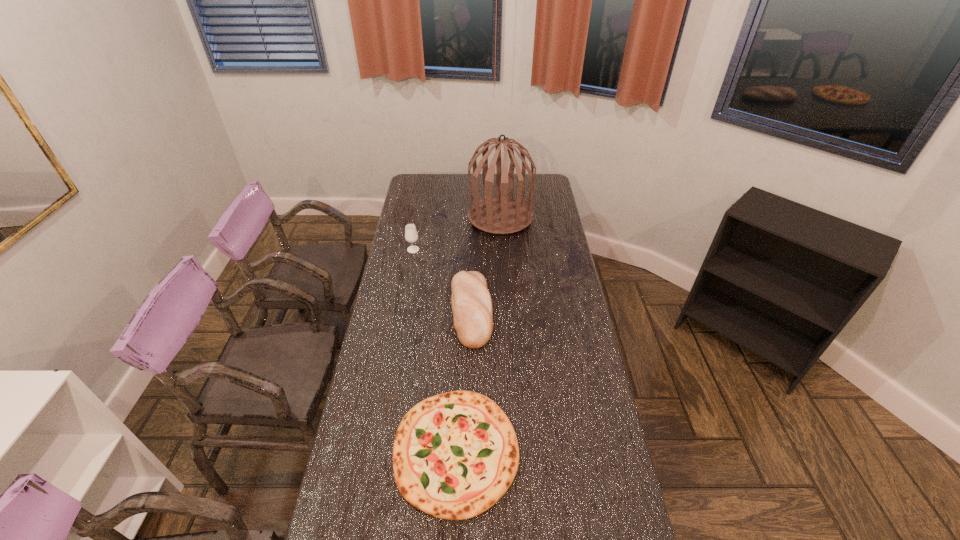
At what (x,y) coordinates should I click in order to perform the action: click on free space that satisfies the following two spatial constraints: 1. on the front side of the third tallest object; 2. on the right side of the third nearest object. Please return your answer as a coordinate pair (x, y). Looking at the image, I should click on (402, 310).